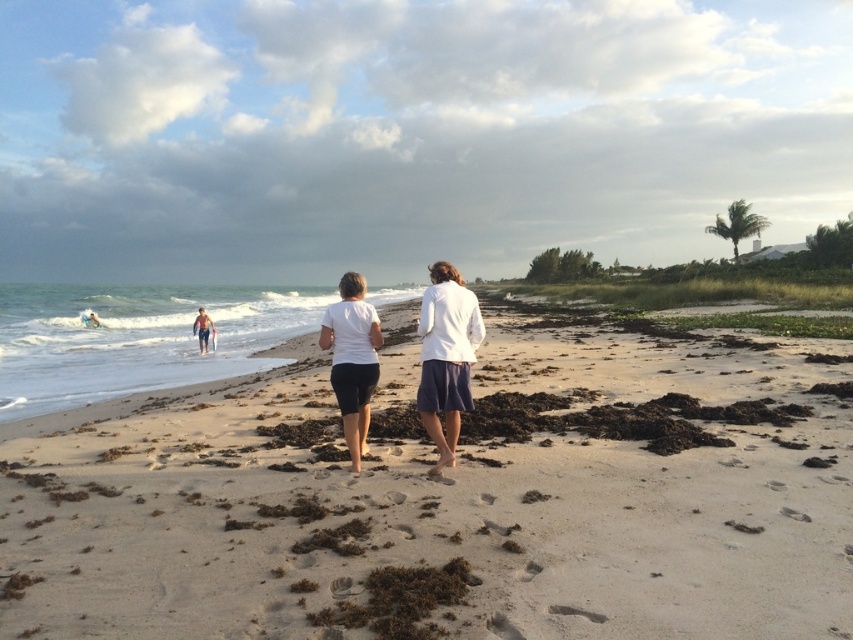
You are a photographer trying to capture a wide shot of the beach scene. You notice the light brown sand at center and the white matte shorts at center. Which object would you focus on first to ensure it takes up more space in your photo?

The light brown sand at center has a larger width than the white matte shorts at center, so focusing on it first would ensure it occupies more space in the photo.

You are a photographer trying to capture a photo of the beach scene. You want to ensure that the light brown sand at center and the white cotton shirts at center are both visible in your shot. Based on their sizes, which object should you focus on to ensure both are in frame?

The light brown sand at center has a larger width than the white cotton shirts at center, so focusing on the light brown sand at center will ensure both are in frame since it occupies more space.